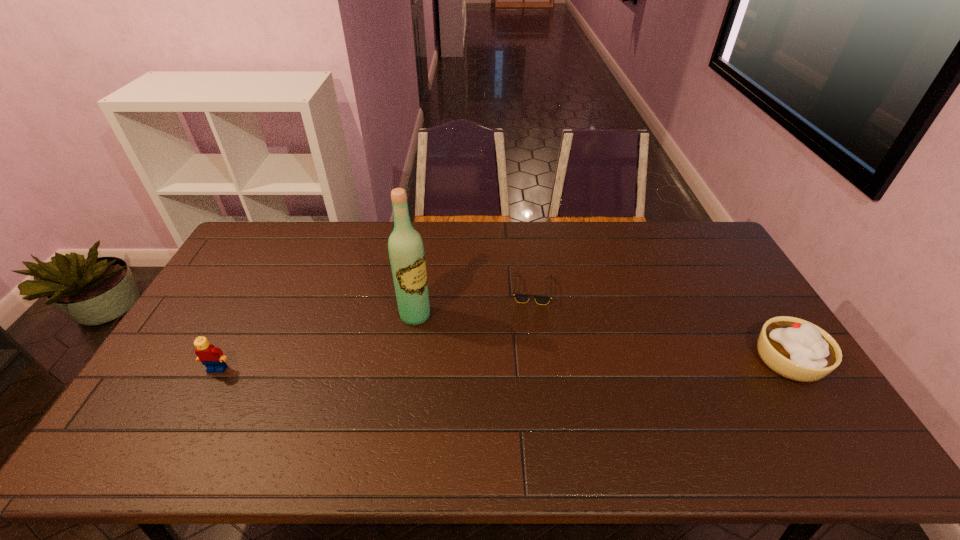
Where is `free space on the desktop that is between the Lego and the whipped cream and is positioned on the lenses of the shortest object`? This screenshot has height=540, width=960. free space on the desktop that is between the Lego and the whipped cream and is positioned on the lenses of the shortest object is located at coordinates (580, 363).

Where is `free spot on the desktop that is between the leftmost object and the whipped cream and is positioned on the front-facing side of the tallest object`? free spot on the desktop that is between the leftmost object and the whipped cream and is positioned on the front-facing side of the tallest object is located at coordinates (482, 364).